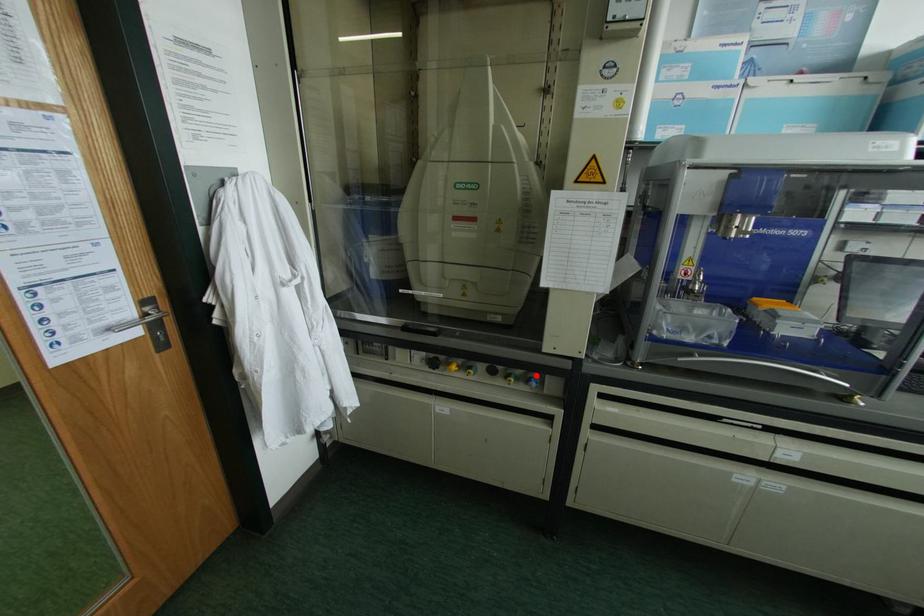
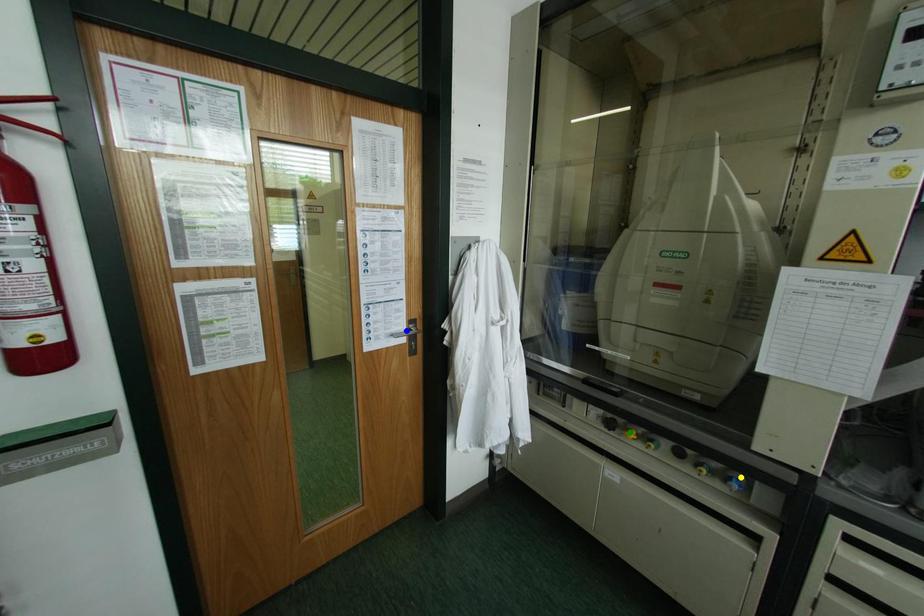
Question: I am providing you with two images of the same scene from different viewpoints. A red point is marked on the first image. You are given multiple points on the second image. Can you choose the point in image 2 that corresponds to the point in image 1?

Choices:
 (A) green point
 (B) yellow point
 (C) blue point

Answer: (B)